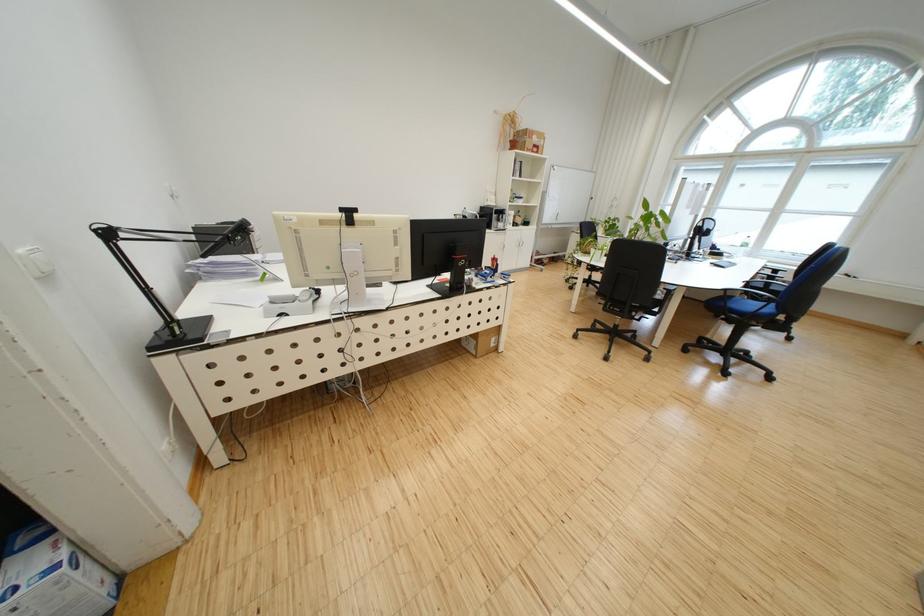
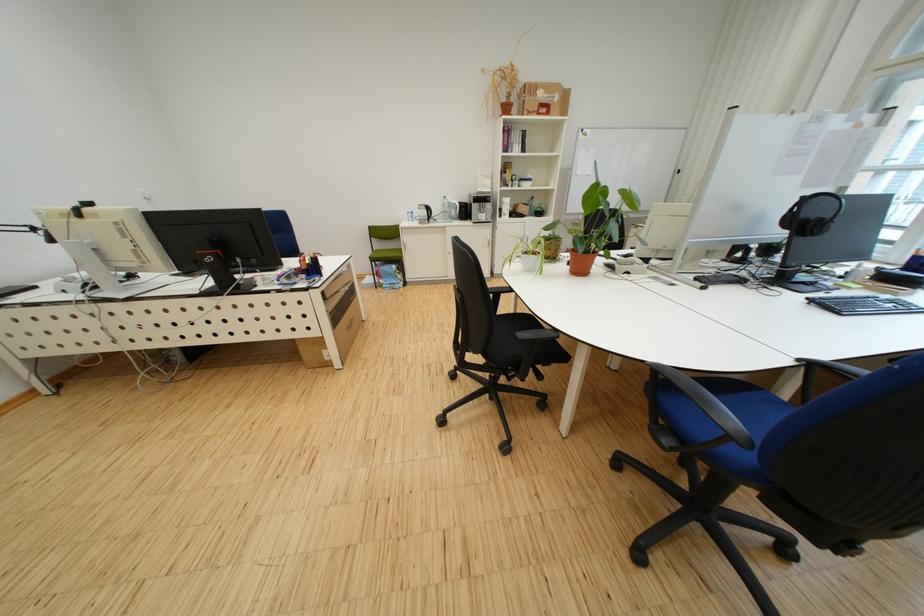
In a continuous first-person perspective shot, in which direction is the camera moving?

The cameraman moved toward right, forward.